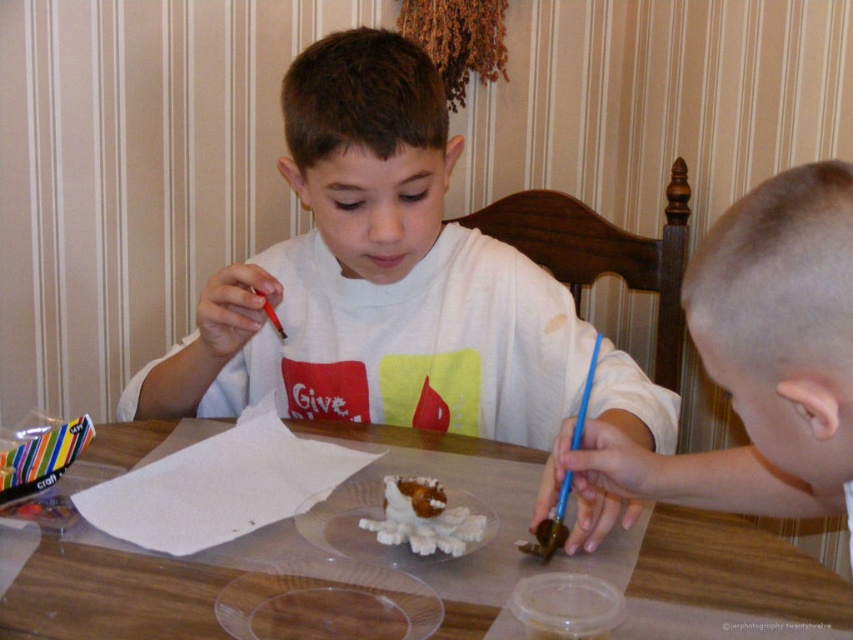
You are standing at the edge of the table looking towards the center. Which direction should you move to reach the blonde hair at right?

The blonde hair at right is located at point 0.564 on the x axis and 0.892 on the y axis. Since you are at the edge of the table looking towards the center, you should move towards the right side of the table to reach the blonde hair at right.

You are a teacher observing the craft activity. You notice the white matte shirt at center and the blonde hair at right. Which object is positioned higher in the image?

The white matte shirt at center is positioned higher than the blonde hair at right in the image.

What is the 2D coordinate of the transparent plastic table at center?

The transparent plastic table at center is located at the 2D coordinate point of (109, 595).